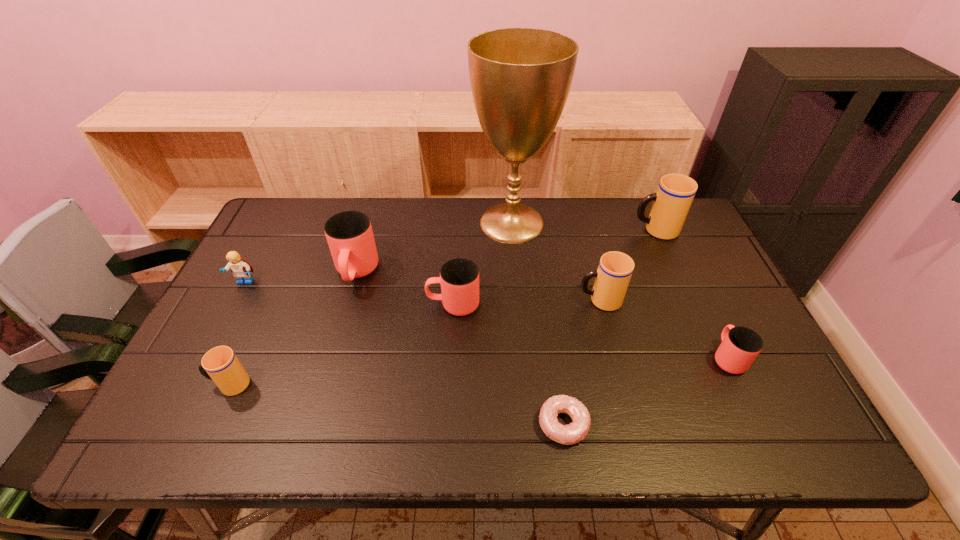
In order to click on the tallest object in this screenshot , I will do `click(520, 78)`.

Find the location of a particular element. Image resolution: width=960 pixels, height=540 pixels. the rightmost beige cup is located at coordinates (671, 203).

Image resolution: width=960 pixels, height=540 pixels. Identify the location of the farthest cup. (671, 203).

Where is `the leftmost pink cup`? The image size is (960, 540). the leftmost pink cup is located at coordinates (349, 234).

Where is `the fifth cup from right to left`? The height and width of the screenshot is (540, 960). the fifth cup from right to left is located at coordinates (349, 234).

Image resolution: width=960 pixels, height=540 pixels. Find the location of `the second farthest beige cup`. the second farthest beige cup is located at coordinates (615, 269).

The image size is (960, 540). Identify the location of the third cup from right to left. (615, 269).

Image resolution: width=960 pixels, height=540 pixels. In order to click on the fourth cup from right to left in this screenshot , I will do `click(459, 278)`.

Image resolution: width=960 pixels, height=540 pixels. Find the location of `the second pink cup from left to right`. the second pink cup from left to right is located at coordinates (459, 278).

The image size is (960, 540). What are the coordinates of `the leftmost object` in the screenshot? It's located at (241, 269).